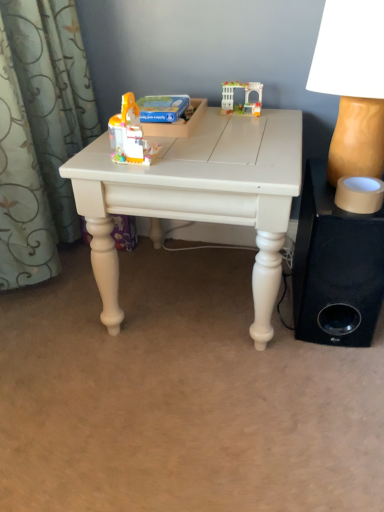
This screenshot has height=512, width=384. Identify the location of free space on the front side of white plastic toy at upper center, arranged as the 1th toy when viewed from the back. (224, 123).